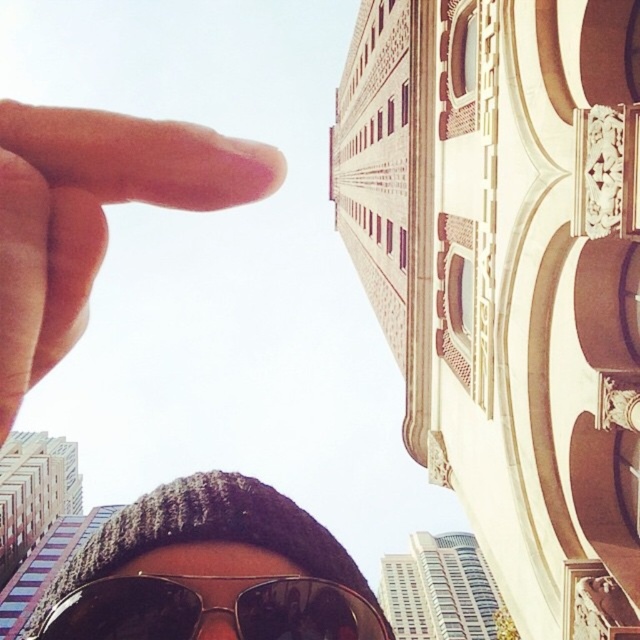
You are a photographer trying to capture the building in the image. You notice the pale skin finger at upper left and the sunglasses at center. Which object is narrower in width when viewed from your current angle?

The pale skin finger at upper left is narrower in width compared to the sunglasses at center.

You are standing in front of a tall building and notice two items on a person in the foreground. Which item is located higher up on the person between the knitted wool hat at center and the sunglasses at center?

The knitted wool hat at center is positioned over the sunglasses at center, so it is higher up on the person.

Where is the knitted wool hat at center located in the image?

The knitted wool hat at center is located at point (211, 572) in the image.